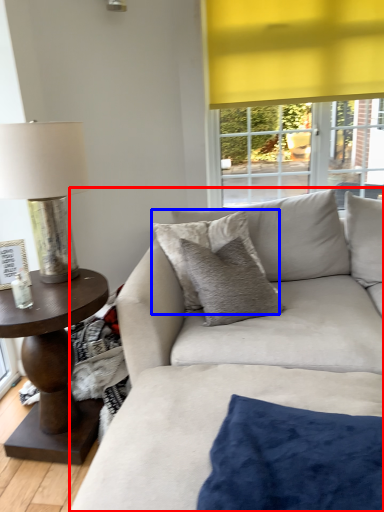
Question: Among these objects, which one is farthest to the camera, studio couch (highlighted by a red box) or pillow (highlighted by a blue box)?

Choices:
 (A) studio couch
 (B) pillow

Answer: (B)